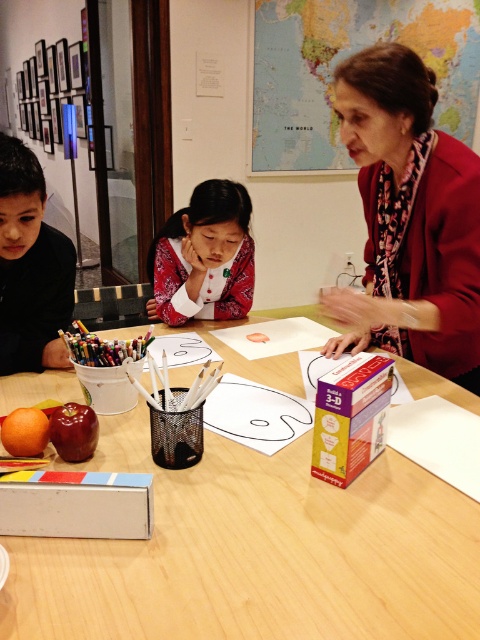
Question: Does shiny red apple at center appear over multicolored wax crayons at lower left?

Choices:
 (A) yes
 (B) no

Answer: (B)

Question: From the image, what is the correct spatial relationship of white cardboard box at lower left in relation to shiny red apple at center?

Choices:
 (A) below
 (B) above

Answer: (A)

Question: Which point is closer to the camera?

Choices:
 (A) (333, 456)
 (B) (101, 497)
 (C) (137, 356)
 (D) (237, 472)

Answer: (B)

Question: Does floral-patterned blouse at upper right lie in front of cardboard box at center?

Choices:
 (A) no
 (B) yes

Answer: (A)

Question: Estimate the real-world distances between objects in this image. Which object is farther from the matte pink blouse at center?

Choices:
 (A) white cardboard box at lower left
 (B) multicolored wax crayons at lower left

Answer: (A)

Question: Among these objects, which one is farthest from the camera?

Choices:
 (A) cardboard box at center
 (B) white cardboard box at lower left
 (C) black matte boy at left
 (D) matte pink blouse at center

Answer: (D)